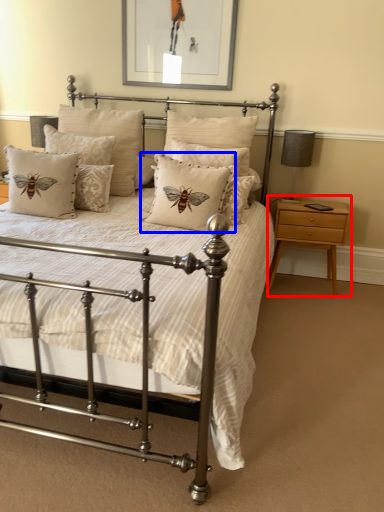
Question: Which point is closer to the camera, nightstand (highlighted by a red box) or pillow (highlighted by a blue box)?

Choices:
 (A) nightstand
 (B) pillow

Answer: (B)